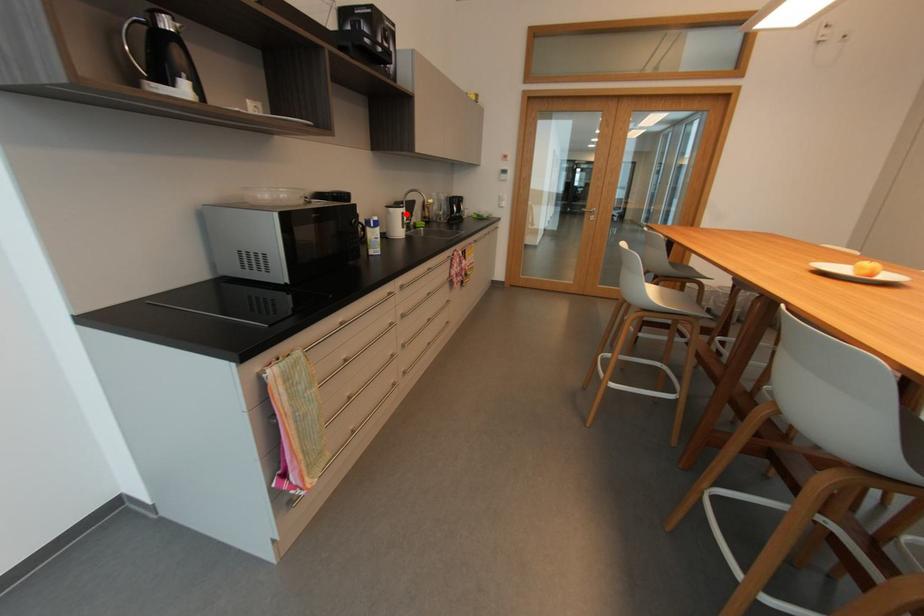
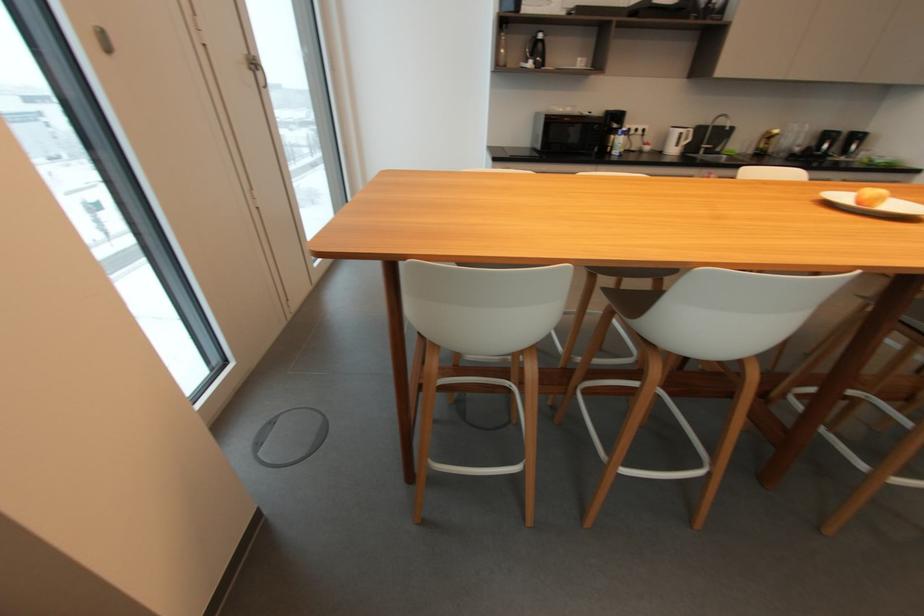
In the second image, find the point that corresponds to the highlighted location in the first image.

(685, 134)